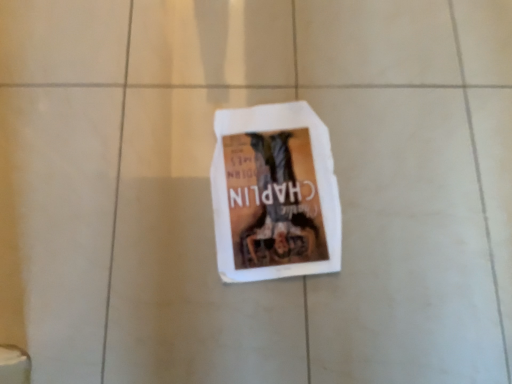
Image resolution: width=512 pixels, height=384 pixels. Identify the location of white paper at center. (274, 194).

What do you see at coordinates (274, 194) in the screenshot? I see `white paper at center` at bounding box center [274, 194].

Where is `white paper at center`? The width and height of the screenshot is (512, 384). white paper at center is located at coordinates (274, 194).